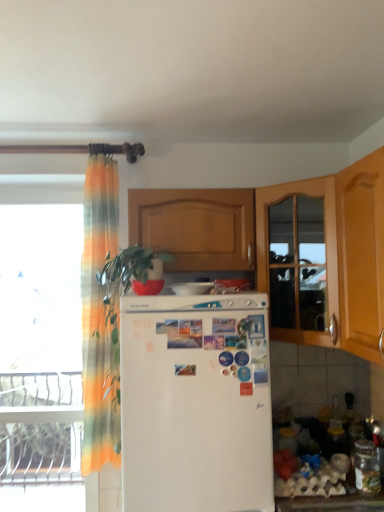
Question: Considering the positions of wooden cabinet at center and white glossy refrigerator at center in the image, is wooden cabinet at center taller or shorter than white glossy refrigerator at center?

Choices:
 (A) short
 (B) tall

Answer: (B)

Question: From the image's perspective, is wooden cabinet at center above or below white glossy refrigerator at center?

Choices:
 (A) above
 (B) below

Answer: (A)

Question: Which of these objects is positioned closest to the translucent orange-green curtain at left?

Choices:
 (A) wooden cabinet at center
 (B) transparent glass window at left
 (C) white glossy refrigerator at center
 (D) wooden cabinet at right
 (E) white matte refrigerator at center

Answer: (A)

Question: Estimate the real-world distances between objects in this image. Which object is farther from the wooden cabinet at right?

Choices:
 (A) white glossy refrigerator at center
 (B) translucent orange-green curtain at left
 (C) transparent glass window at left
 (D) white matte refrigerator at center
 (E) wooden cabinet at center

Answer: (C)